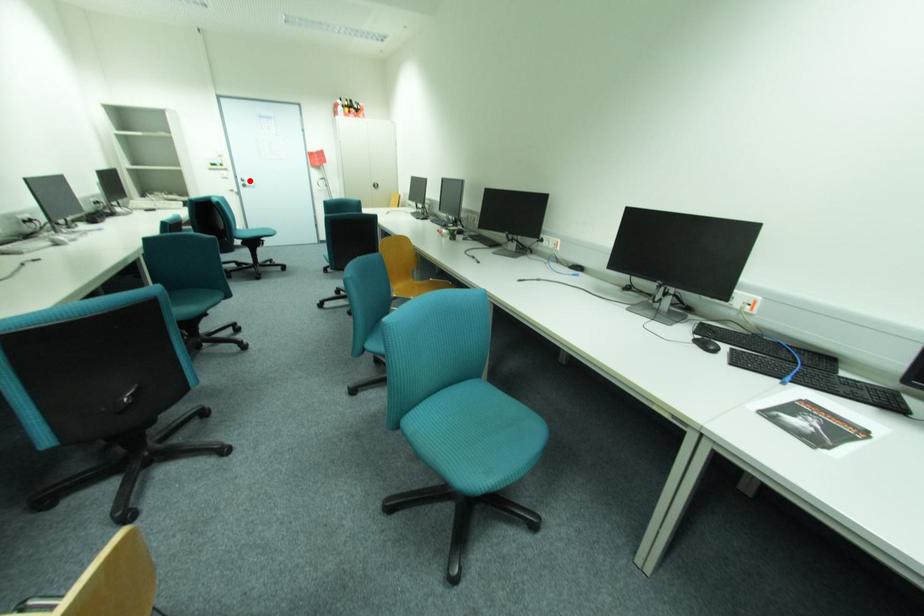
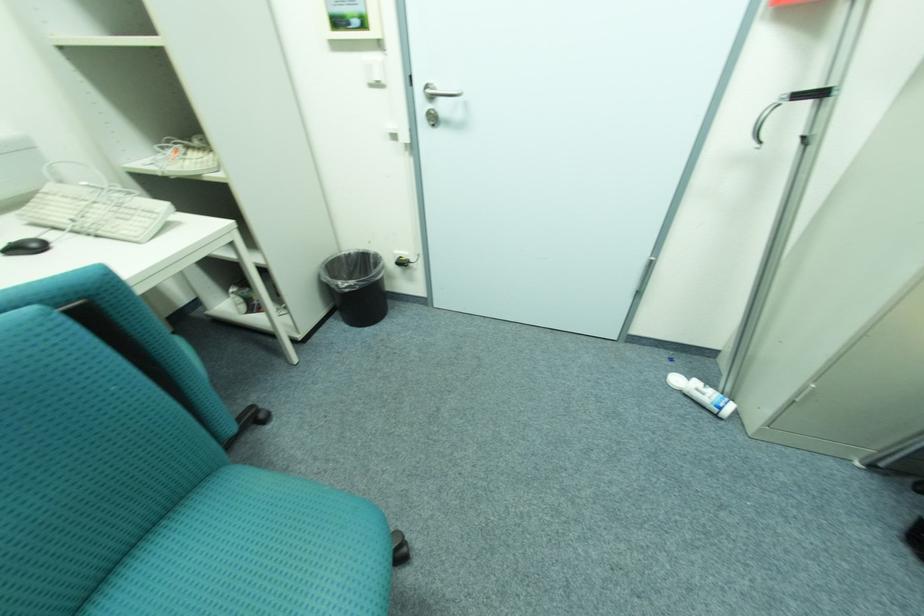
In the second image, find the point that corresponds to the highlighted location in the first image.

(439, 97)